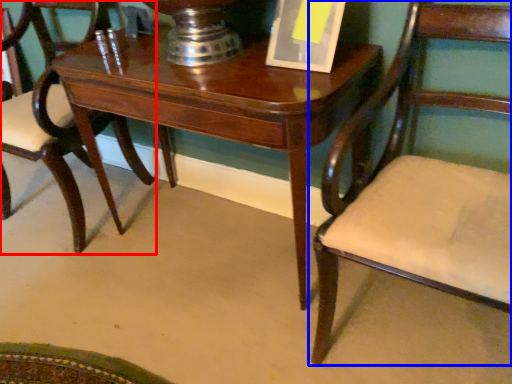
Question: Which point is further to the camera, chair (highlighted by a red box) or chair (highlighted by a blue box)?

Choices:
 (A) chair
 (B) chair

Answer: (A)